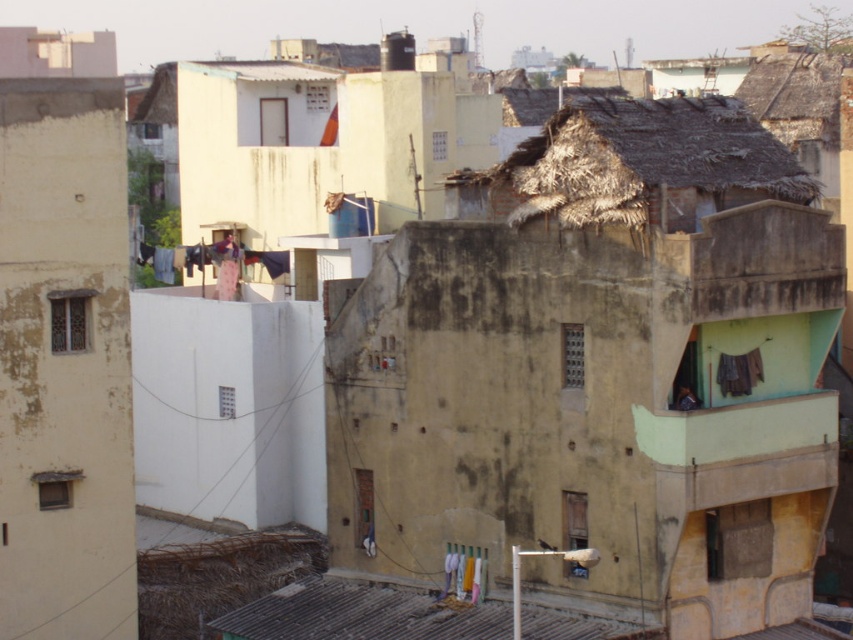
You are a delivery person trying to navigate through the narrow alley between the rusty corrugated metal roof at lower center and the brown fabric at right. Which side should you walk closer to avoid obstacles?

The rusty corrugated metal roof at lower center is positioned on the left side of brown fabric at right, so walking closer to the left side would keep you away from the brown fabric at right and any potential obstacles on the right.

You are a delivery drone trying to land on the rusty corrugated metal roof at lower center. The landing coordinates are set to point 0.959, 0.426. Is this the correct location?

Yes, the rusty corrugated metal roof at lower center is located at point [363,612], so the landing coordinates are correct.